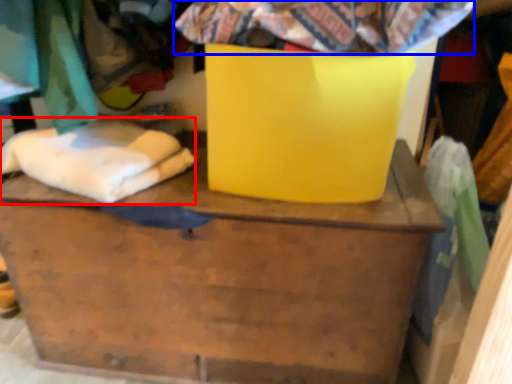
Question: Which point is further to the camera, linen (highlighted by a red box) or fabric (highlighted by a blue box)?

Choices:
 (A) linen
 (B) fabric

Answer: (A)